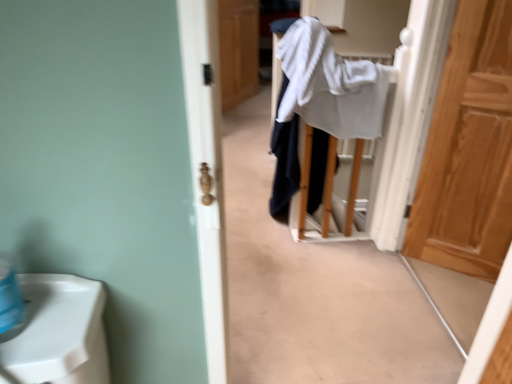
Describe the element at coordinates (330, 84) in the screenshot. I see `white cotton bath towel at center` at that location.

At what (x,y) coordinates should I click in order to perform the action: click on white cotton bath towel at center. Please return your answer as a coordinate pair (x, y). Looking at the image, I should click on (330, 84).

From a real-world perspective, is wooden door at center, the 2th door from the front, positioned above or below light brown wood door at right, which appears as the second door when viewed from the top?

Clearly, from a real-world perspective, wooden door at center, the 2th door from the front, is below light brown wood door at right, which appears as the second door when viewed from the top.

How many degrees apart are the facing directions of wooden door at center, the first door positioned from the left, and light brown wood door at right, acting as the 1th door starting from the bottom?

wooden door at center, the first door positioned from the left, and light brown wood door at right, acting as the 1th door starting from the bottom, are facing 88.6 degrees away from each other.

Would you say wooden door at center, the second door from the right, is outside light brown wood door at right, which ranks as the 1th door in front-to-back order?

Yes, wooden door at center, the second door from the right, is located beyond the bounds of light brown wood door at right, which ranks as the 1th door in front-to-back order.

How much distance is there between wooden door at center, the 2th door from the front, and light brown wood door at right, which ranks as the 1th door in front-to-back order?

wooden door at center, the 2th door from the front, is 8.24 feet from light brown wood door at right, which ranks as the 1th door in front-to-back order.

Which is more to the left, white cotton bath towel at center or light brown wood door at right, the 2th door when ordered from left to right?

white cotton bath towel at center.

Is point (376, 69) positioned in front of point (499, 130)?

No, it is behind (499, 130).

From the image's perspective, which object appears higher, white cotton bath towel at center or light brown wood door at right, the 2th door when ordered from left to right?

From the image's view, white cotton bath towel at center is above.

Identify the location of door that appears below the white cotton bath towel at center (from the image's perspective). Image resolution: width=512 pixels, height=384 pixels. (469, 150).

From a real-world perspective, which object rests below the other?

In real-world perspective, light brown wood door at right, the first door from the right, is lower.

Is light brown wood door at right, acting as the 1th door starting from the bottom, situated inside white cotton bath towel at center or outside?

light brown wood door at right, acting as the 1th door starting from the bottom, is located beyond the bounds of white cotton bath towel at center.

From the picture: Is light brown wood door at right, acting as the 1th door starting from the bottom, directly adjacent to white cotton bath towel at center?

light brown wood door at right, acting as the 1th door starting from the bottom, is not next to white cotton bath towel at center, and they're not touching.

Does light brown wood door at right, acting as the 1th door starting from the bottom, have a greater height compared to white cotton bath towel at center?

Correct, light brown wood door at right, acting as the 1th door starting from the bottom, is much taller as white cotton bath towel at center.

Is light brown wood door at right, which is the second door from back to front, situated inside wooden door at center, the second door from the right, or outside?

light brown wood door at right, which is the second door from back to front, is spatially situated outside wooden door at center, the second door from the right.

The image size is (512, 384). Find the location of `door below the wooden door at center, arranged as the first door when viewed from the top (from the image's perspective)`. door below the wooden door at center, arranged as the first door when viewed from the top (from the image's perspective) is located at coordinates (469, 150).

In the scene shown: From the image's perspective, does light brown wood door at right, acting as the 1th door starting from the bottom, appear lower than wooden door at center, placed as the 2th door when sorted from bottom to top?

Correct, light brown wood door at right, acting as the 1th door starting from the bottom, appears lower than wooden door at center, placed as the 2th door when sorted from bottom to top, in the image.

Which of these two, light brown wood door at right, the 2th door when ordered from left to right, or wooden door at center, the first door positioned from the left, stands shorter?

With less height is wooden door at center, the first door positioned from the left.

From the image's perspective, between white cotton bath towel at center and wooden door at center, the first door positioned from the back, which one is located above?

wooden door at center, the first door positioned from the back, from the image's perspective.

Find the location of a particular element. This screenshot has width=512, height=384. door above the white cotton bath towel at center (from the image's perspective) is located at coordinates (238, 50).

Is white cotton bath towel at center placed right next to wooden door at center, the second door from the right?

There is a gap between white cotton bath towel at center and wooden door at center, the second door from the right.

Who is smaller, white cotton bath towel at center or wooden door at center, the 2th door from the front?

Smaller between the two is wooden door at center, the 2th door from the front.

Could you tell me if wooden door at center, placed as the 2th door when sorted from bottom to top, is turned towards white cotton bath towel at center?

No, wooden door at center, placed as the 2th door when sorted from bottom to top, does not turn towards white cotton bath towel at center.

From a real-world perspective, which object stands above the other?

white cotton bath towel at center, from a real-world perspective.

Based on their sizes in the image, would you say wooden door at center, placed as the 2th door when sorted from bottom to top, is bigger or smaller than white cotton bath towel at center?

In the image, wooden door at center, placed as the 2th door when sorted from bottom to top, appears to be smaller than white cotton bath towel at center.

Image resolution: width=512 pixels, height=384 pixels. What are the coordinates of `door on the right side of wooden door at center, arranged as the first door when viewed from the top` in the screenshot? It's located at (469, 150).

The height and width of the screenshot is (384, 512). I want to click on bath towel that appears behind the light brown wood door at right, the first door from the right, so click(330, 84).

From the image, which object appears to be farther from light brown wood door at right, acting as the 1th door starting from the bottom, white cotton bath towel at center or wooden door at center, arranged as the first door when viewed from the top?

The object further to light brown wood door at right, acting as the 1th door starting from the bottom, is wooden door at center, arranged as the first door when viewed from the top.

From the image, which object appears to be farther from white cotton bath towel at center, light brown wood door at right, acting as the 1th door starting from the bottom, or wooden door at center, the first door positioned from the back?

Based on the image, wooden door at center, the first door positioned from the back, appears to be further to white cotton bath towel at center.

Estimate the real-world distances between objects in this image. Which object is further from white cotton bath towel at center, wooden door at center, placed as the 2th door when sorted from bottom to top, or light brown wood door at right, the first door from the right?

wooden door at center, placed as the 2th door when sorted from bottom to top, is positioned further to the anchor white cotton bath towel at center.

In the scene shown: Estimate the real-world distances between objects in this image. Which object is closer to wooden door at center, the first door positioned from the left, light brown wood door at right, which appears as the second door when viewed from the top, or white cotton bath towel at center?

Based on the image, white cotton bath towel at center appears to be nearer to wooden door at center, the first door positioned from the left.

When comparing their distances from light brown wood door at right, which appears as the second door when viewed from the top, does wooden door at center, the first door positioned from the back, or white cotton bath towel at center seem further?

Among the two, wooden door at center, the first door positioned from the back, is located further to light brown wood door at right, which appears as the second door when viewed from the top.

Looking at this image, based on their spatial positions, is white cotton bath towel at center or light brown wood door at right, the 2th door when ordered from left to right, closer to wooden door at center, arranged as the first door when viewed from the top?

Based on the image, white cotton bath towel at center appears to be nearer to wooden door at center, arranged as the first door when viewed from the top.

This screenshot has height=384, width=512. I want to click on bath towel positioned between light brown wood door at right, which ranks as the 1th door in front-to-back order, and wooden door at center, placed as the 2th door when sorted from bottom to top, from near to far, so click(x=330, y=84).